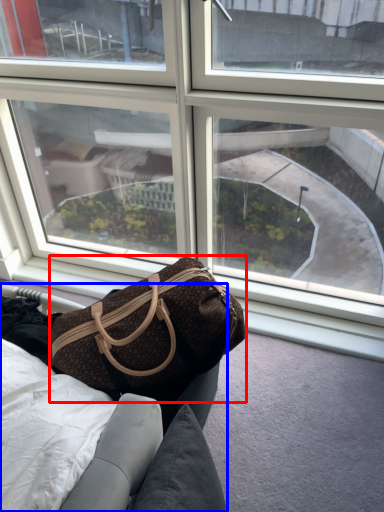
Question: Which object is further to the camera taking this photo, handbag (highlighted by a red box) or furniture (highlighted by a blue box)?

Choices:
 (A) handbag
 (B) furniture

Answer: (B)